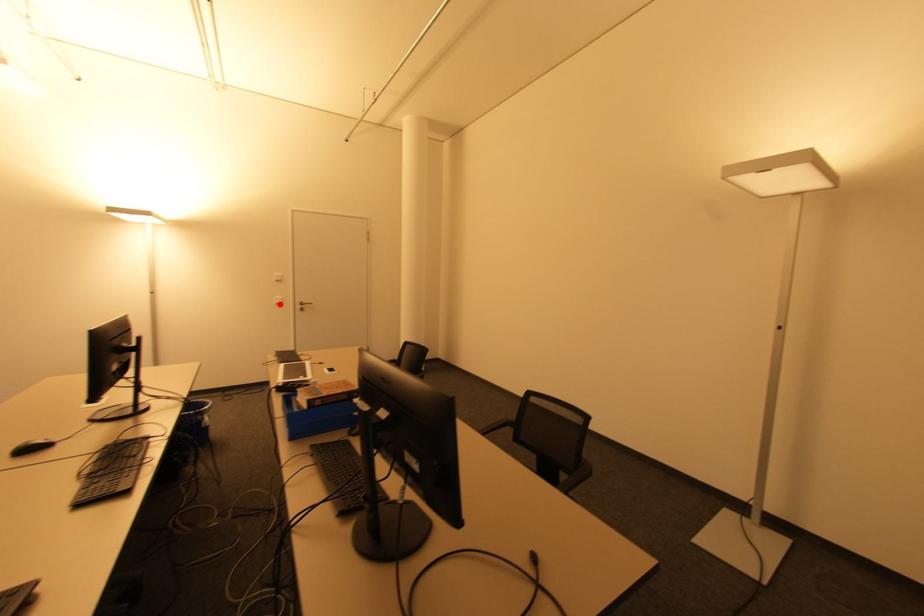
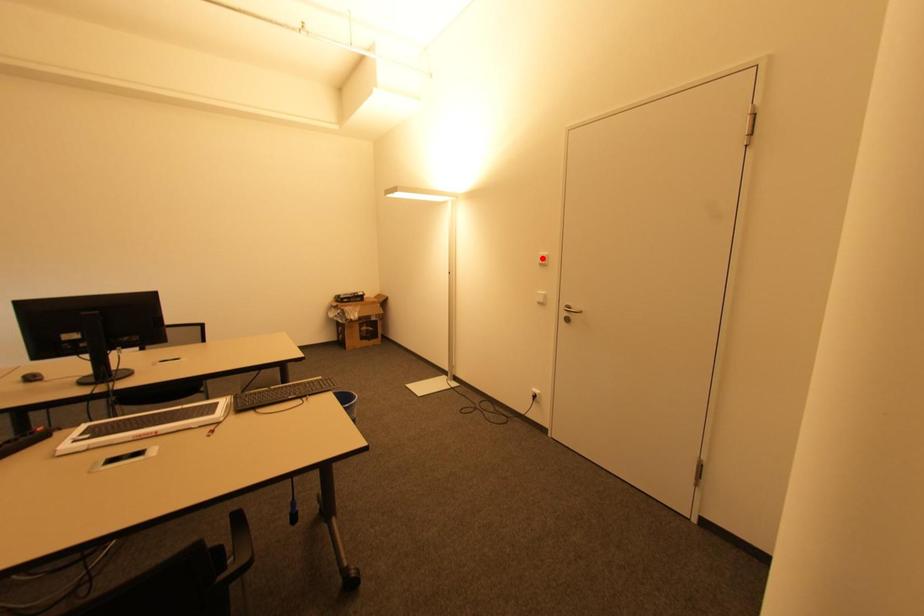
From the picture: I am providing you with two images of the same scene from different viewpoints. A red point is marked on the first image and another point is marked on the second image. Are the points marked in image1 and image2 representing the same 3D position?

No